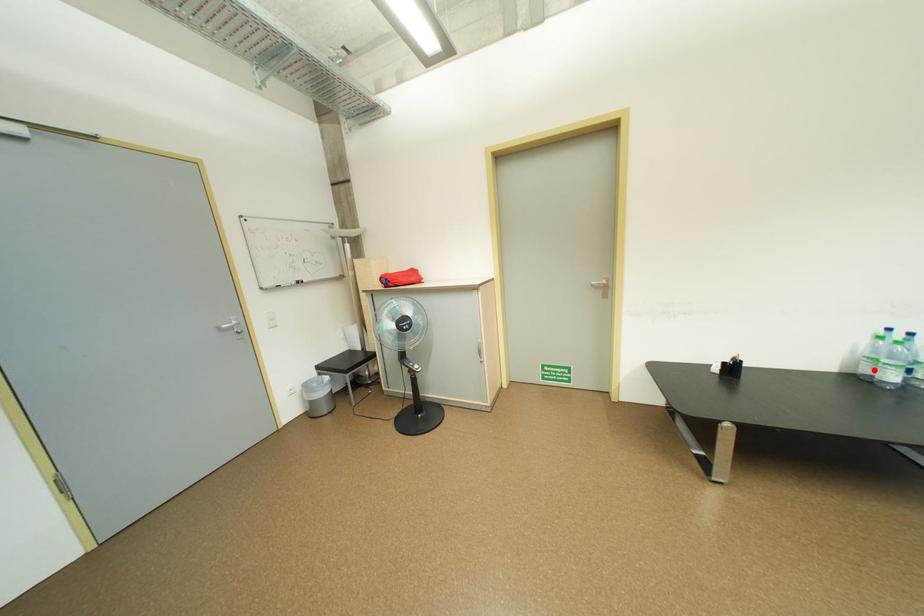
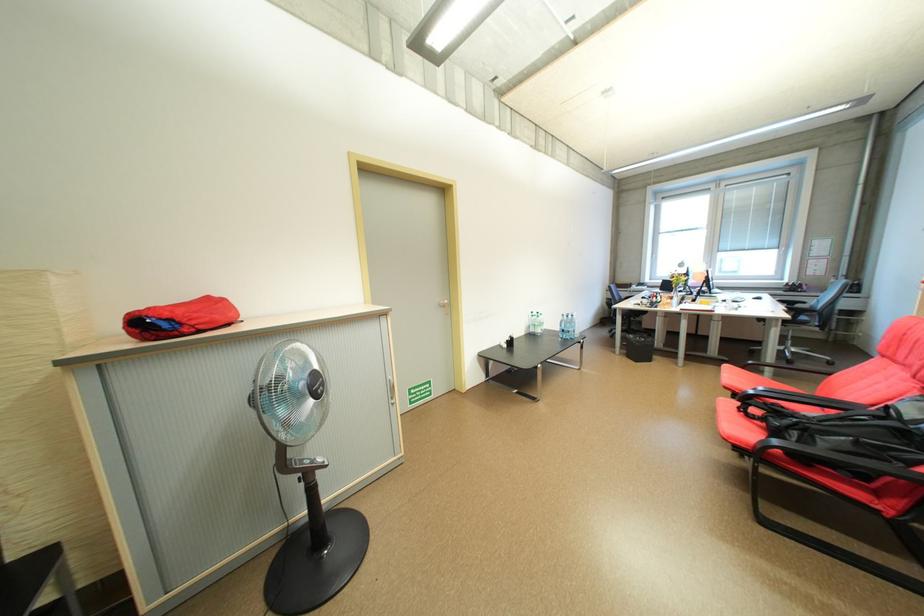
Where in the second image is the point corresponding to the highlighted location from the first image?

(541, 331)